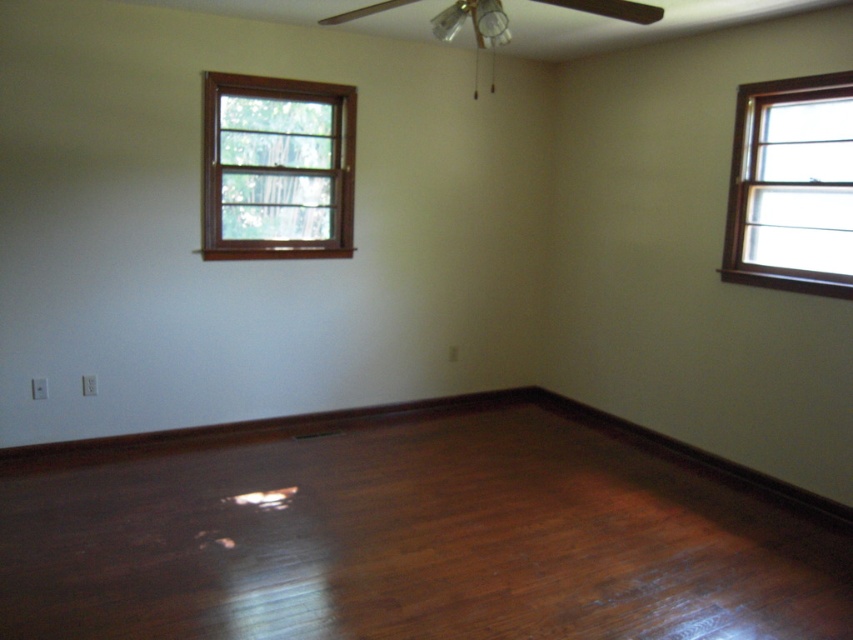
From the picture: You are moving a large piece of furniture into the room. The furniture is as wide as the brown wooden window at upper left. Can you place it on the shiny brown hardwood floor at center without it overlapping the window?

The shiny brown hardwood floor at center is larger in size than the brown wooden window at upper left. Since the furniture is as wide as the window, it can fit on the floor without overlapping the window.

You are moving a 7.5 feet long sofa into the room. The sofa must be placed between the shiny brown hardwood floor at center and the nearest wall. Is there enough space for the sofa to fit without being tilted?

The distance between the shiny brown hardwood floor at center and the nearest wall is 8.13 feet. Since the sofa is 7.5 feet long, it will fit with 0.63 feet of space remaining. Therefore, the sofa can be placed there without tilting.